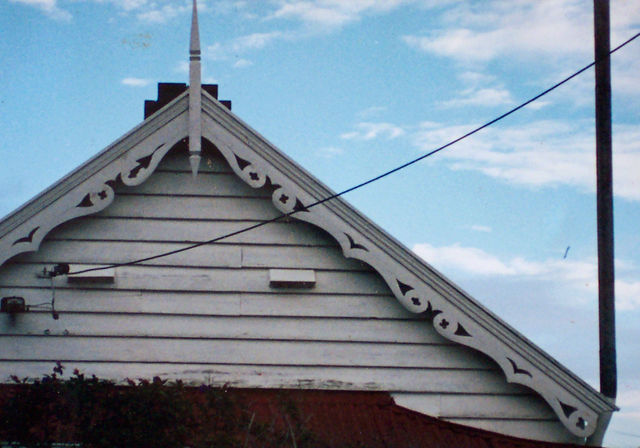
In order to click on air vents in this screenshot , I will do (102, 280), (294, 284).